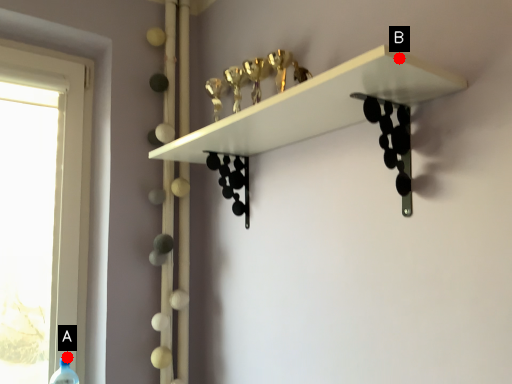
Question: Two points are circled on the image, labeled by A and B beside each circle. Among these points, which one is farthest from the camera?

Choices:
 (A) A is further
 (B) B is further

Answer: (A)